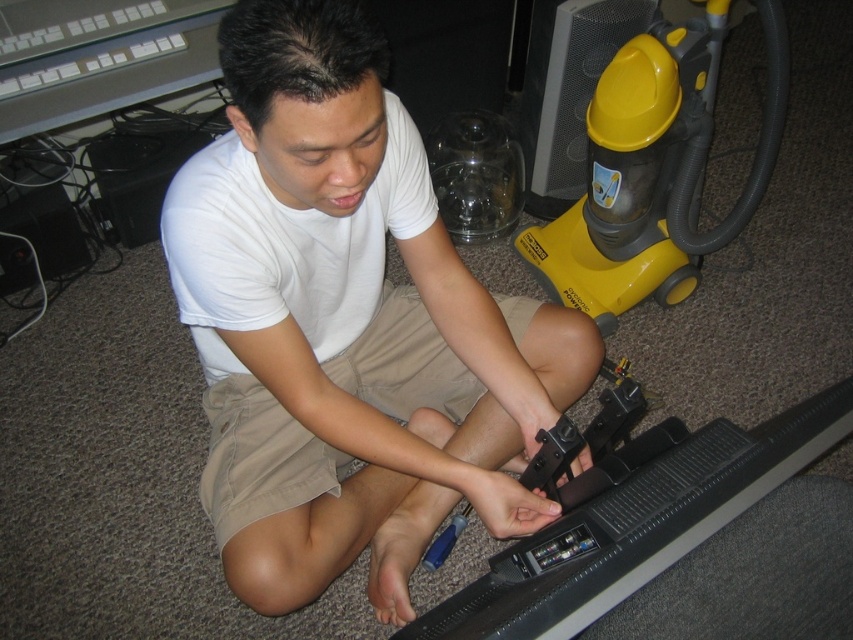
Does white matte shirt at center have a greater height compared to black plastic tv at lower center?

Yes, white matte shirt at center is taller than black plastic tv at lower center.

Where is `white matte shirt at center`? white matte shirt at center is located at coordinates (346, 324).

Between point (328, 481) and point (724, 452), which one is positioned behind?

Positioned behind is point (328, 481).

Locate an element on the screen. This screenshot has height=640, width=853. white matte shirt at center is located at coordinates (346, 324).

Is black plastic tv at lower center bigger than yellow plastic vacuum cleaner at right?

No.

Is black plastic tv at lower center wider than yellow plastic vacuum cleaner at right?

No, black plastic tv at lower center is not wider than yellow plastic vacuum cleaner at right.

Between point (566, 486) and point (604, 280), which one is positioned in front?

Point (566, 486) is more forward.

The height and width of the screenshot is (640, 853). I want to click on black plastic tv at lower center, so click(634, 520).

How much distance is there between white matte shirt at center and khaki shorts at center?

The distance of white matte shirt at center from khaki shorts at center is 11.05 centimeters.

Which of these two, white matte shirt at center or khaki shorts at center, stands shorter?

khaki shorts at center

Is point (329, 579) behind point (512, 301)?

No, (329, 579) is in front of (512, 301).

Locate an element on the screen. The height and width of the screenshot is (640, 853). white matte shirt at center is located at coordinates (346, 324).